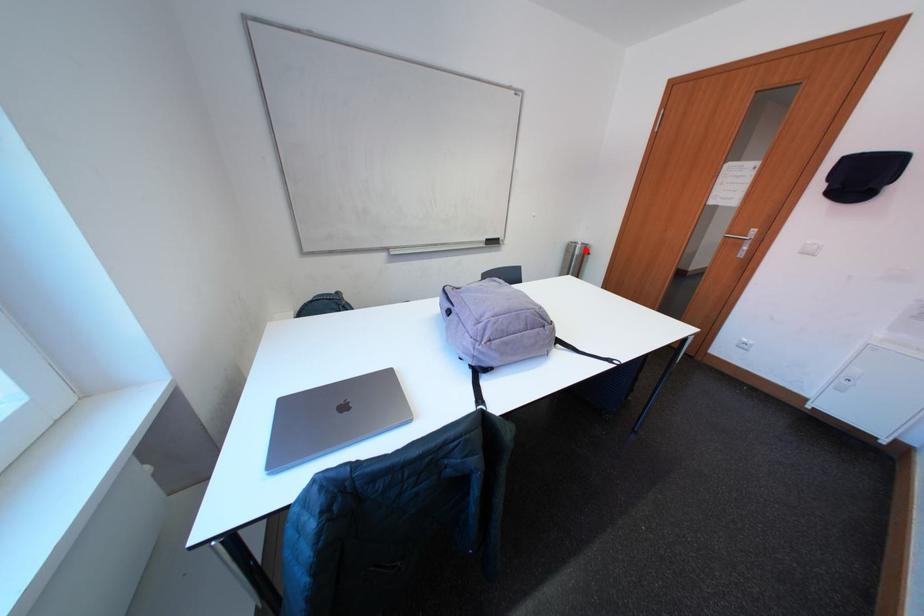
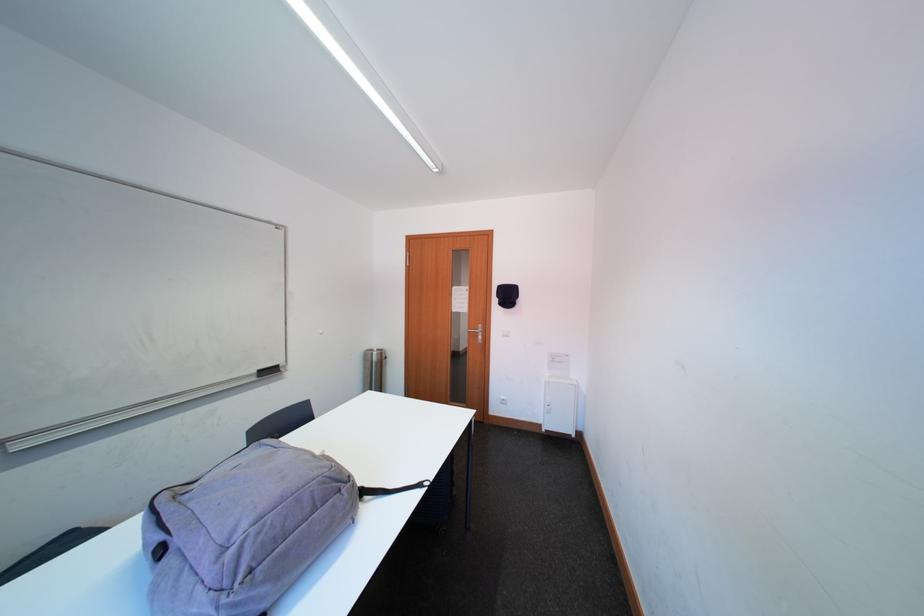
In the second image, find the point that corresponds to the highlighted location in the first image.

(382, 358)